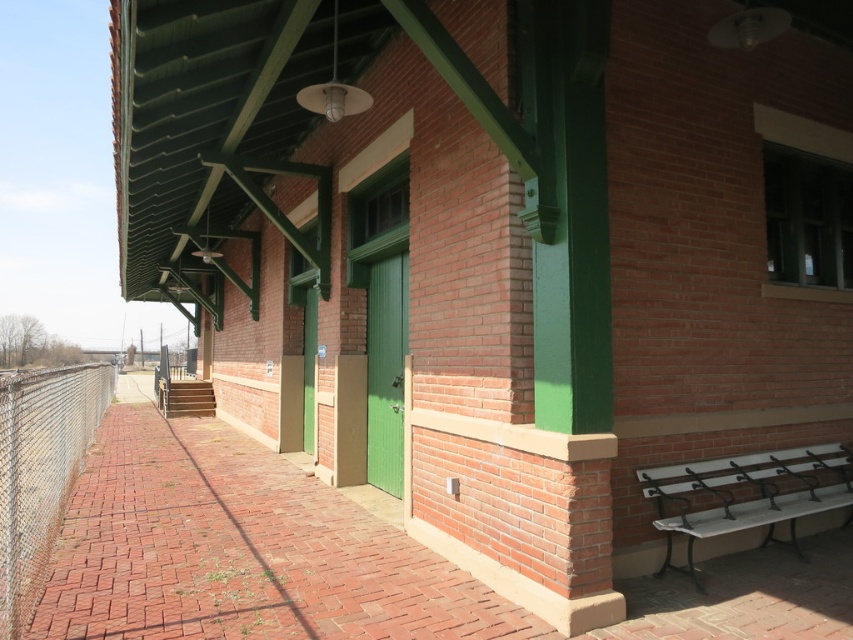
You are standing in front of the brick building and see a point marked at coordinates (39, 472). Based on the scene description, where is this point located?

The point at coordinates (39, 472) is located on the chain link fence at left.